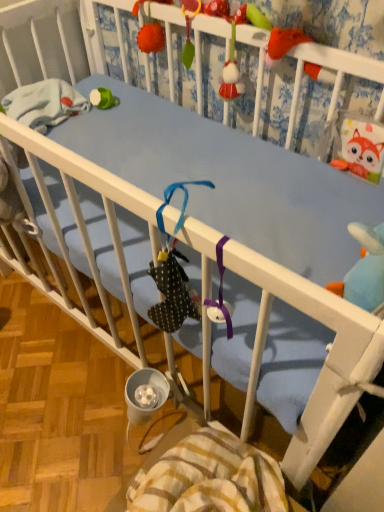
Question: Is striped cotton blanket at lower center shorter than fluffy orange pom-pom at upper center?

Choices:
 (A) yes
 (B) no

Answer: (B)

Question: Is striped cotton blanket at lower center in front of fluffy orange pom-pom at upper center?

Choices:
 (A) no
 (B) yes

Answer: (B)

Question: Would you say striped cotton blanket at lower center contains fluffy orange pom-pom at upper center?

Choices:
 (A) no
 (B) yes

Answer: (A)

Question: Considering the relative sizes of striped cotton blanket at lower center and fluffy orange pom-pom at upper center in the image provided, is striped cotton blanket at lower center smaller than fluffy orange pom-pom at upper center?

Choices:
 (A) yes
 (B) no

Answer: (B)

Question: Is striped cotton blanket at lower center outside of fluffy orange pom-pom at upper center?

Choices:
 (A) no
 (B) yes

Answer: (B)

Question: Is striped cotton blanket at lower center thinner than fluffy orange pom-pom at upper center?

Choices:
 (A) no
 (B) yes

Answer: (A)

Question: Can you confirm if blue fabric crib at upper center is shorter than fluffy orange pom-pom at upper center?

Choices:
 (A) yes
 (B) no

Answer: (B)

Question: Is the depth of blue fabric crib at upper center greater than that of fluffy orange pom-pom at upper center?

Choices:
 (A) no
 (B) yes

Answer: (A)

Question: Is blue fabric crib at upper center to the left of fluffy orange pom-pom at upper center from the viewer's perspective?

Choices:
 (A) no
 (B) yes

Answer: (A)

Question: Is blue fabric crib at upper center facing towards fluffy orange pom-pom at upper center?

Choices:
 (A) no
 (B) yes

Answer: (B)

Question: Does blue fabric crib at upper center touch fluffy orange pom-pom at upper center?

Choices:
 (A) yes
 (B) no

Answer: (B)

Question: Can you confirm if blue fabric crib at upper center is smaller than fluffy orange pom-pom at upper center?

Choices:
 (A) no
 (B) yes

Answer: (A)

Question: Is fluffy orange pom-pom at upper center located outside striped cotton blanket at lower center?

Choices:
 (A) no
 (B) yes

Answer: (B)